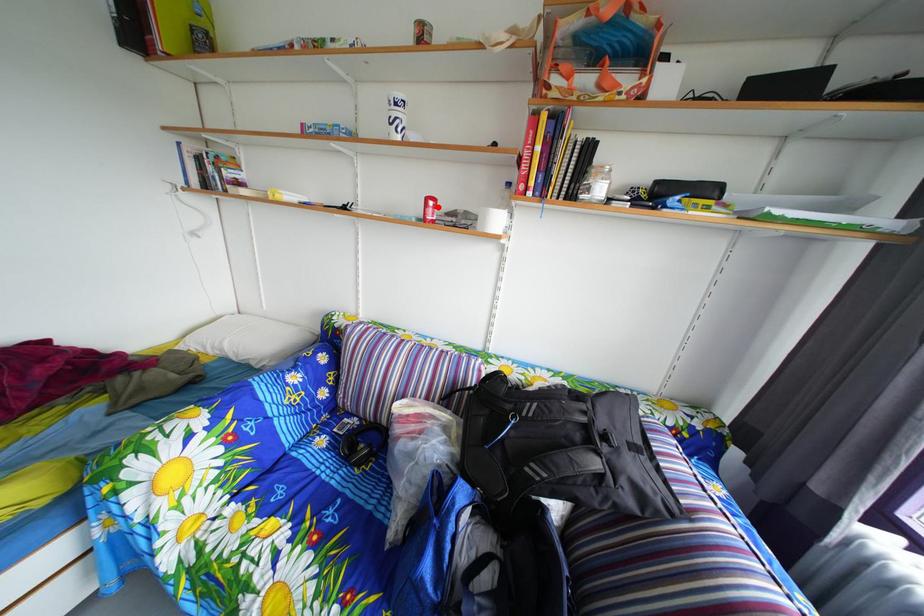
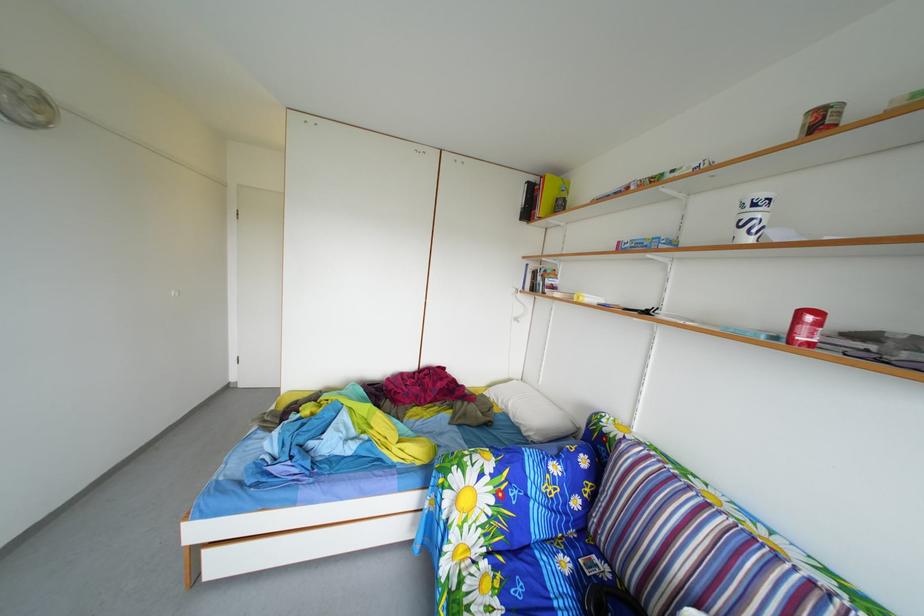
Locate, in the second image, the point that corresponds to the highlighted location in the first image.

(811, 321)